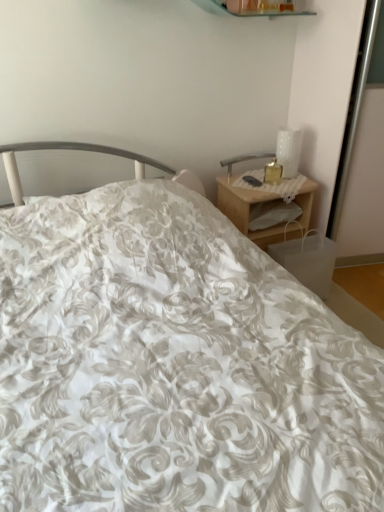
What are the coordinates of `free space in front of white glossy table lamp at upper right` in the screenshot? It's located at (283, 181).